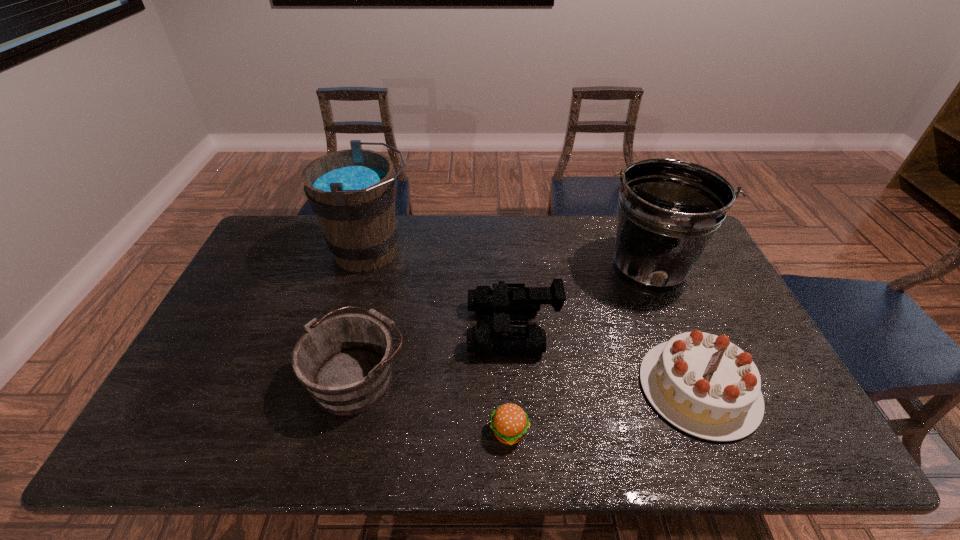
Identify the location of free location that satisfies the following two spatial constraints: 1. on the back side of the hamburger; 2. on the left side of the bucket. The height and width of the screenshot is (540, 960). (501, 269).

Where is `free point that satisfies the following two spatial constraints: 1. on the front side of the birthday cake; 2. on the right side of the shorter wine bucket`? Image resolution: width=960 pixels, height=540 pixels. free point that satisfies the following two spatial constraints: 1. on the front side of the birthday cake; 2. on the right side of the shorter wine bucket is located at coordinates (355, 388).

The width and height of the screenshot is (960, 540). I want to click on vacant region that satisfies the following two spatial constraints: 1. on the back side of the nearer wine bucket; 2. with a handle on the side of the taller wine bucket, so click(388, 252).

The height and width of the screenshot is (540, 960). Identify the location of blank area in the image that satisfies the following two spatial constraints: 1. with a handle on the side of the taller wine bucket; 2. on the right side of the shorter wine bucket. (336, 376).

The image size is (960, 540). I want to click on vacant space that satisfies the following two spatial constraints: 1. with a handle on the side of the taller wine bucket; 2. on the back side of the birthday cake, so click(x=333, y=388).

Identify the location of free region that satisfies the following two spatial constraints: 1. on the front lenses of the binoculars; 2. on the front side of the shortest object. (519, 431).

Where is `vacant space that satisfies the following two spatial constraints: 1. with a handle on the side of the farther wine bucket; 2. on the right side of the shortest object`? vacant space that satisfies the following two spatial constraints: 1. with a handle on the side of the farther wine bucket; 2. on the right side of the shortest object is located at coordinates (321, 431).

Locate an element on the screen. vacant space that satisfies the following two spatial constraints: 1. with a handle on the side of the farther wine bucket; 2. on the left side of the nearer wine bucket is located at coordinates (336, 376).

The height and width of the screenshot is (540, 960). Find the location of `free spot that satisfies the following two spatial constraints: 1. on the front lenses of the binoculars; 2. on the front side of the hamburger`. free spot that satisfies the following two spatial constraints: 1. on the front lenses of the binoculars; 2. on the front side of the hamburger is located at coordinates (519, 431).